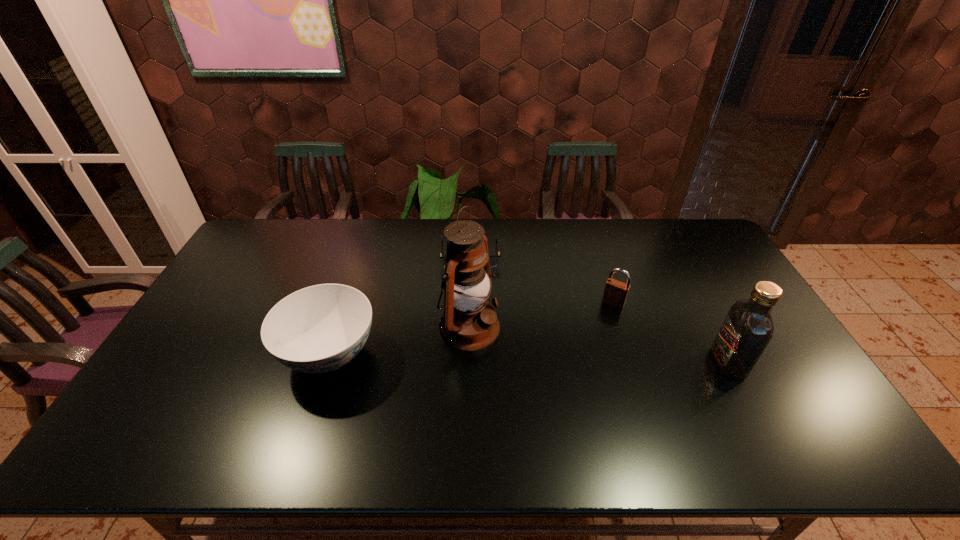
This screenshot has width=960, height=540. I want to click on free spot on the desktop that is between the chinaware and the rightmost object and is positioned on the side of the tallest object, there is a wick adjustment knob, so click(x=537, y=359).

What are the coordinates of `vacant space on the desktop that is between the chinaware and the rightmost object and is positioned on the front-facing side of the shortest object` in the screenshot? It's located at (473, 357).

Where is `vacant space on the desktop that is between the chinaware and the fourth shortest object and is positioned on the front-facing side of the second object from right to left`? vacant space on the desktop that is between the chinaware and the fourth shortest object and is positioned on the front-facing side of the second object from right to left is located at coordinates pyautogui.click(x=580, y=360).